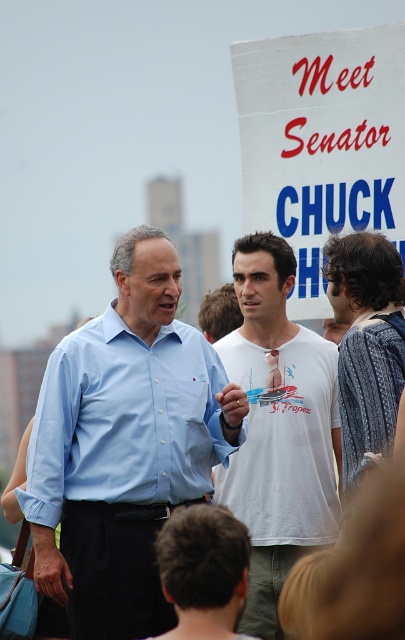
Question: Considering the relative positions of white paper sign at upper center and matte blue shirt at center in the image provided, where is white paper sign at upper center located with respect to matte blue shirt at center?

Choices:
 (A) above
 (B) below

Answer: (A)

Question: Is patterned fabric shirt at right wider than brown hair at lower center?

Choices:
 (A) no
 (B) yes

Answer: (A)

Question: Which of these objects is positioned closest to the brown hair at lower center?

Choices:
 (A) white paper sign at upper center
 (B) white cotton t-shirt at center
 (C) matte blue shirt at center
 (D) patterned fabric shirt at right

Answer: (C)

Question: Which point is farther to the camera?

Choices:
 (A) (179, 352)
 (B) (381, 305)

Answer: (A)

Question: Is white paper sign at upper center to the left of white cotton t-shirt at center from the viewer's perspective?

Choices:
 (A) no
 (B) yes

Answer: (A)

Question: Which object appears closest to the camera in this image?

Choices:
 (A) patterned fabric shirt at right
 (B) white paper sign at upper center
 (C) white cotton t-shirt at center

Answer: (A)